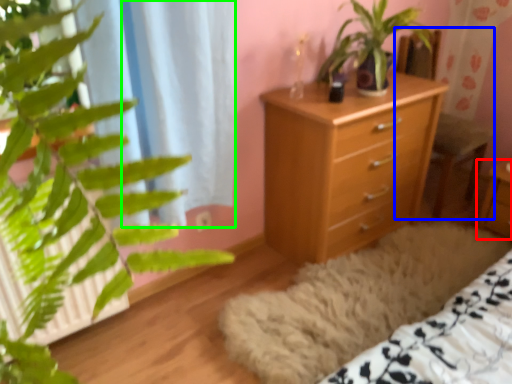
Question: Considering the real-world distances, which object is farthest from nightstand (highlighted by a red box)? armchair (highlighted by a blue box) or curtain (highlighted by a green box)?

Choices:
 (A) armchair
 (B) curtain

Answer: (B)